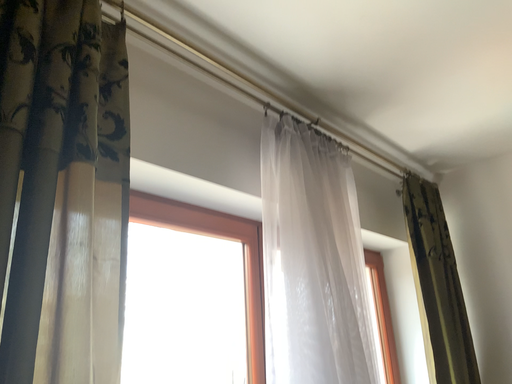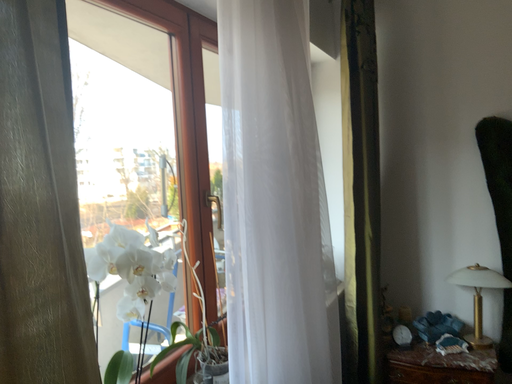
Question: Which way did the camera rotate in the video?

Choices:
 (A) rotated upward
 (B) rotated downward

Answer: (B)